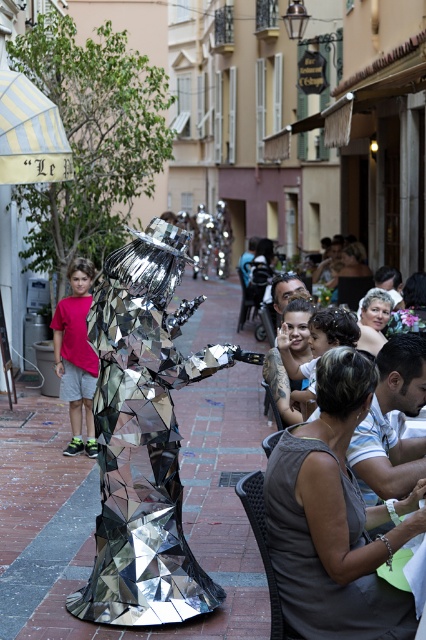
Question: Among these objects, which one is nearest to the camera?

Choices:
 (A) reflective metallic figure at center
 (B) shiny metallic robot at lower right
 (C) mirrored metallic sculpture at center

Answer: (A)

Question: Estimate the real-world distances between objects in this image. Which object is closer to the mirrored metallic sculpture at center?

Choices:
 (A) shiny metallic robot at lower right
 (B) reflective metallic figure at center

Answer: (A)

Question: Does mirrored metallic sculpture at center have a greater width compared to shiny metallic robot at lower right?

Choices:
 (A) yes
 (B) no

Answer: (A)

Question: Can you confirm if reflective metallic figure at center is thinner than shiny metallic robot at lower right?

Choices:
 (A) no
 (B) yes

Answer: (A)

Question: Among these objects, which one is nearest to the camera?

Choices:
 (A) shiny metallic robot at lower right
 (B) reflective metallic figure at center

Answer: (B)

Question: Is reflective metallic figure at center above shiny metallic robot at lower right?

Choices:
 (A) no
 (B) yes

Answer: (A)